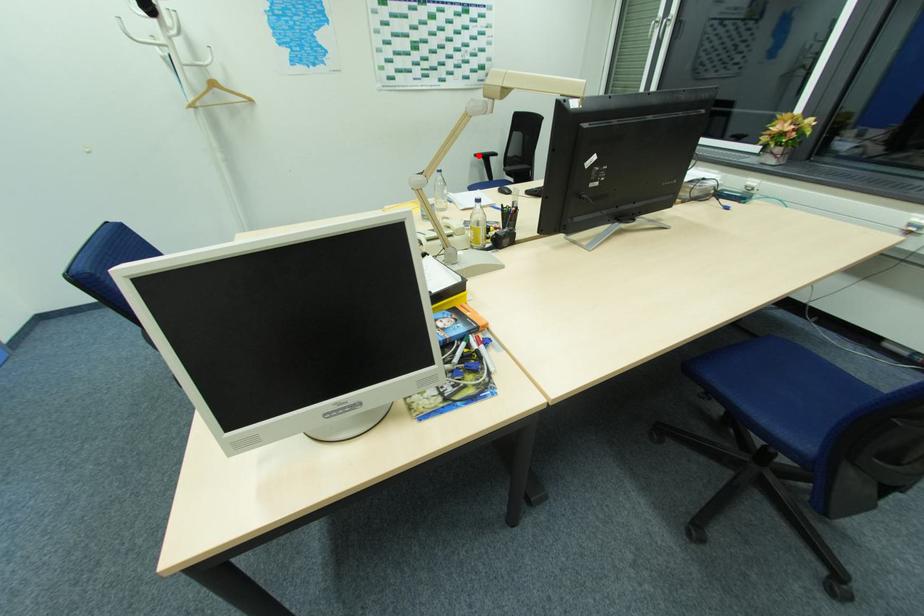
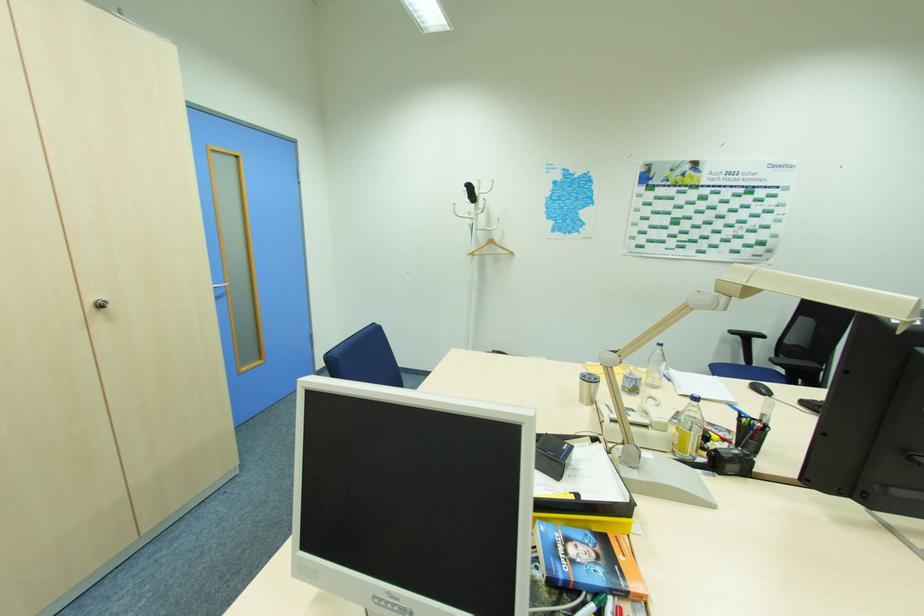
Question: I am providing you with two images of the same scene from different viewpoints. Given a red point in image1, look at the same physical point in image2. Is it:

Choices:
 (A) Closer to the viewpoint
 (B) Farther from the viewpoint

Answer: (B)